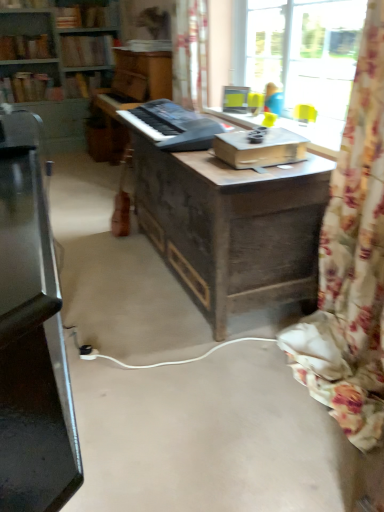
Question: Can you confirm if hardcover book at upper left, marked as the 6th book in a bottom-to-top arrangement, is shorter than wooden bookshelf at upper left, the 3th book from the top?

Choices:
 (A) yes
 (B) no

Answer: (A)

Question: From the image's perspective, does hardcover book at upper left, marked as the 6th book in a bottom-to-top arrangement, appear lower than wooden bookshelf at upper left, which is the 4th book from bottom to top?

Choices:
 (A) no
 (B) yes

Answer: (A)

Question: Is the depth of hardcover book at upper left, which appears as the first book when viewed from the top, less than that of wooden bookshelf at upper left, which is the 4th book from bottom to top?

Choices:
 (A) no
 (B) yes

Answer: (B)

Question: From a real-world perspective, is hardcover book at upper left, marked as the 6th book in a bottom-to-top arrangement, below wooden bookshelf at upper left, the 3th book from the top?

Choices:
 (A) yes
 (B) no

Answer: (B)

Question: Is hardcover book at upper left, marked as the 6th book in a bottom-to-top arrangement, placed right next to wooden bookshelf at upper left, which is the 4th book from bottom to top?

Choices:
 (A) no
 (B) yes

Answer: (A)

Question: Are hardcover book at upper left, which appears as the first book when viewed from the top, and wooden bookshelf at upper left, which is the 4th book from bottom to top, far apart?

Choices:
 (A) yes
 (B) no

Answer: (B)

Question: Is floral fabric curtain at right, marked as the second curtain in a top-to-bottom arrangement, placed right next to hardcover book at upper left, which ranks as the 5th book in bottom-to-top order?

Choices:
 (A) no
 (B) yes

Answer: (A)

Question: Does floral fabric curtain at right, which is counted as the second curtain, starting from the back, have a larger size compared to hardcover book at upper left, which is the 2th book from top to bottom?

Choices:
 (A) yes
 (B) no

Answer: (A)

Question: Considering the relative sizes of floral fabric curtain at right, which is counted as the second curtain, starting from the back, and hardcover book at upper left, which ranks as the 5th book in bottom-to-top order, in the image provided, is floral fabric curtain at right, which is counted as the second curtain, starting from the back, wider than hardcover book at upper left, which ranks as the 5th book in bottom-to-top order,?

Choices:
 (A) yes
 (B) no

Answer: (A)

Question: From a real-world perspective, is floral fabric curtain at right, which is counted as the second curtain, starting from the back, on hardcover book at upper left, which is the 2th book from top to bottom?

Choices:
 (A) yes
 (B) no

Answer: (B)

Question: From the image's perspective, does floral fabric curtain at right, acting as the 1th curtain starting from the bottom, appear higher than hardcover book at upper left, which is the 2th book from top to bottom?

Choices:
 (A) no
 (B) yes

Answer: (A)

Question: Is floral fabric curtain at right, which is counted as the second curtain, starting from the back, thinner than hardcover book at upper left, which is the 2th book from top to bottom?

Choices:
 (A) yes
 (B) no

Answer: (B)

Question: Would you say hardcover book at upper left, which ranks as the 5th book in bottom-to-top order, is outside hardcover book at upper left, which is the sixth book in top-to-bottom order?

Choices:
 (A) no
 (B) yes

Answer: (B)